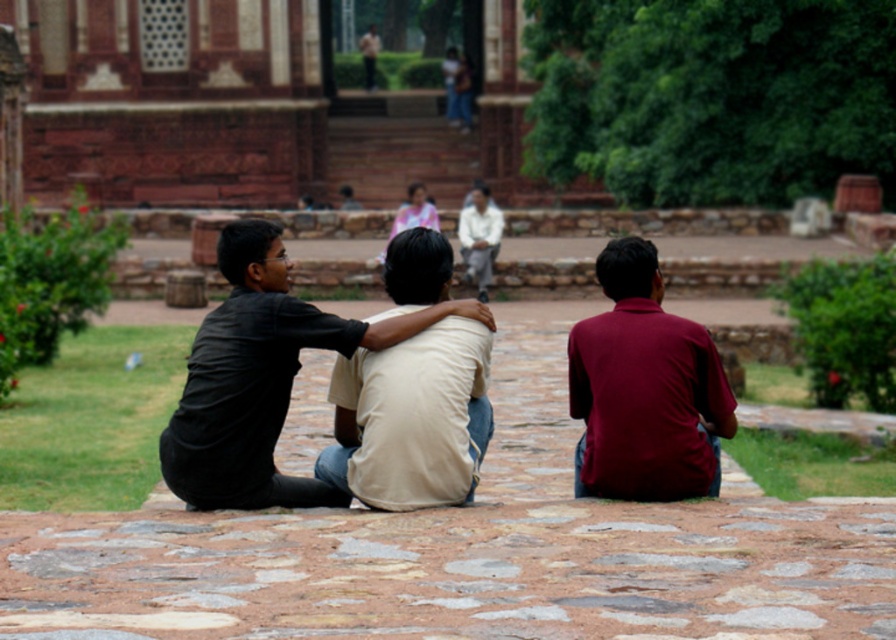
Question: Among these objects, which one is farthest from the camera?

Choices:
 (A) matte black shirt at center
 (B) maroon cotton shirt at center

Answer: (B)

Question: Is the position of matte black shirt at center more distant than that of maroon cotton shirt at center?

Choices:
 (A) no
 (B) yes

Answer: (A)

Question: From the image, what is the correct spatial relationship of matte black shirt at center in relation to maroon cotton shirt at center?

Choices:
 (A) left
 (B) right

Answer: (A)

Question: Among these points, which one is nearest to the camera?

Choices:
 (A) (632, 387)
 (B) (218, 403)

Answer: (B)

Question: Does matte black shirt at center appear under maroon cotton shirt at center?

Choices:
 (A) no
 (B) yes

Answer: (B)